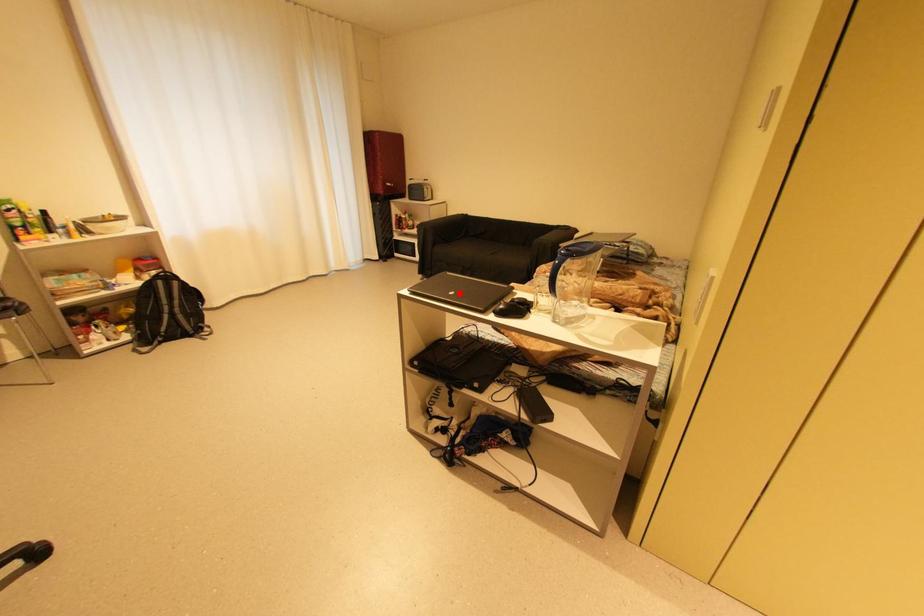
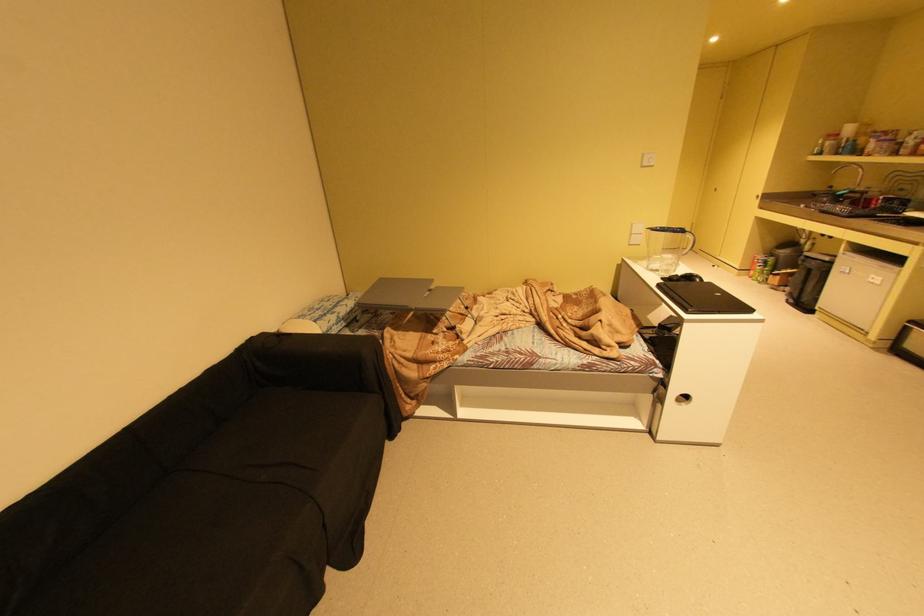
Find the pixel in the second image that matches the highlighted location in the first image.

(726, 294)